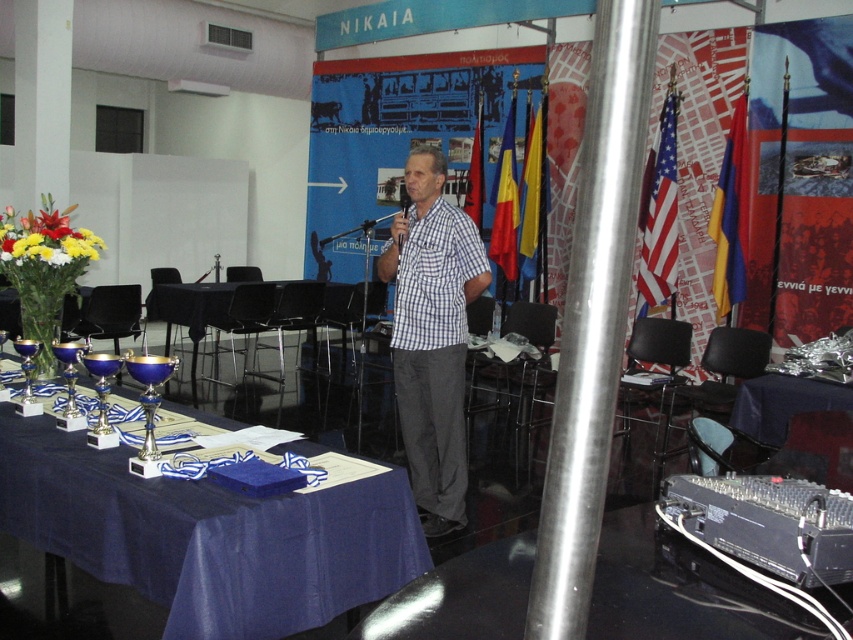
Between white checkered shirt at center and black plastic microphone at center, which one appears on the right side from the viewer's perspective?

Positioned to the right is white checkered shirt at center.

Locate an element on the screen. white checkered shirt at center is located at coordinates (432, 337).

Is point (456, 308) positioned behind point (761, 381)?

That is False.

Can you confirm if white checkered shirt at center is bigger than blue fabric table at lower right?

Indeed, white checkered shirt at center has a larger size compared to blue fabric table at lower right.

In order to click on white checkered shirt at center in this screenshot , I will do `click(432, 337)`.

You are a GUI agent. You are given a task and a screenshot of the screen. Output one action in this format:
    pyautogui.click(x=<x>, y=<y>)
    Task: Click on the white checkered shirt at center
    This screenshot has height=640, width=853.
    Given the screenshot: What is the action you would take?
    pyautogui.click(x=432, y=337)

Does blue fabric table at lower right have a greater width compared to vibrant floral bouquet at left?

Correct, the width of blue fabric table at lower right exceeds that of vibrant floral bouquet at left.

Is blue fabric table at lower right bigger than vibrant floral bouquet at left?

Correct, blue fabric table at lower right is larger in size than vibrant floral bouquet at left.

Which is behind, point (775, 465) or point (90, 252)?

Positioned behind is point (90, 252).

Locate an element on the screen. The image size is (853, 640). blue fabric table at lower right is located at coordinates (798, 426).